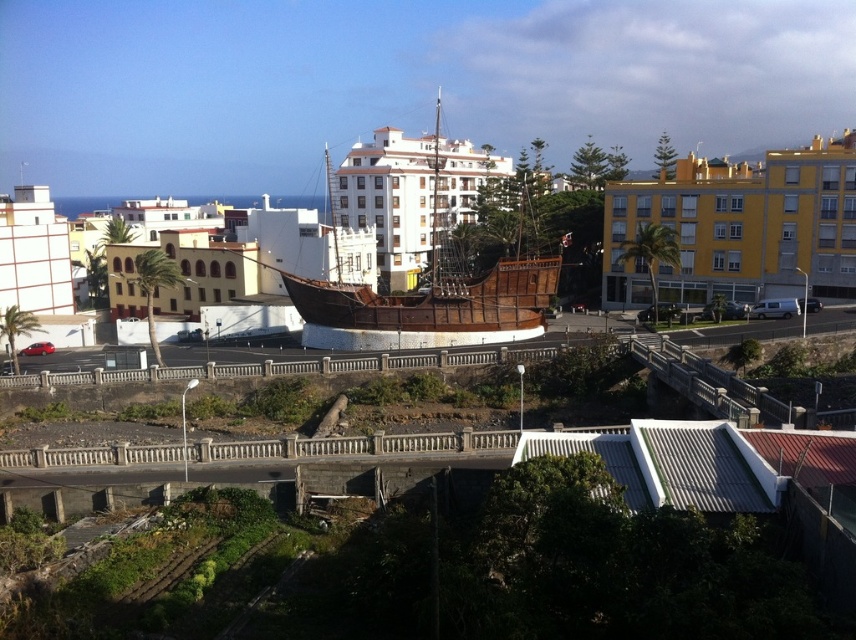
Is point (714, 220) farther from camera compared to point (3, 241)?

No, (714, 220) is in front of (3, 241).

Is yellow matte building at center above white textured building at left?

Yes.

Between point (694, 234) and point (48, 221), which one is positioned behind?

The point (48, 221) is more distant.

Where is `yellow matte building at center`? The height and width of the screenshot is (640, 856). yellow matte building at center is located at coordinates (738, 227).

Between yellow matte building at center and wooden pirate ship at center, which one has more height?

Standing taller between the two is wooden pirate ship at center.

Is yellow matte building at center positioned before wooden pirate ship at center?

No, it is behind wooden pirate ship at center.

The image size is (856, 640). What do you see at coordinates (738, 227) in the screenshot?
I see `yellow matte building at center` at bounding box center [738, 227].

The image size is (856, 640). I want to click on yellow matte building at center, so click(738, 227).

Does yellow matte building at center have a greater width compared to white matte building at center?

No.

Is point (735, 202) less distant than point (455, 221)?

Yes, point (735, 202) is in front of point (455, 221).

Image resolution: width=856 pixels, height=640 pixels. What are the coordinates of `yellow matte building at center` in the screenshot? It's located at (738, 227).